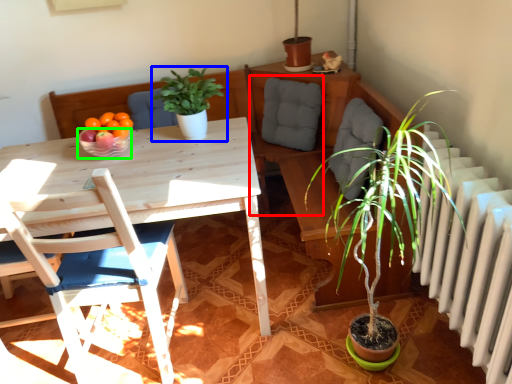
Question: Considering the real-world distances, which object is closest to swivel chair (highlighted by a red box)? houseplant (highlighted by a blue box) or bowl (highlighted by a green box).

Choices:
 (A) houseplant
 (B) bowl

Answer: (A)